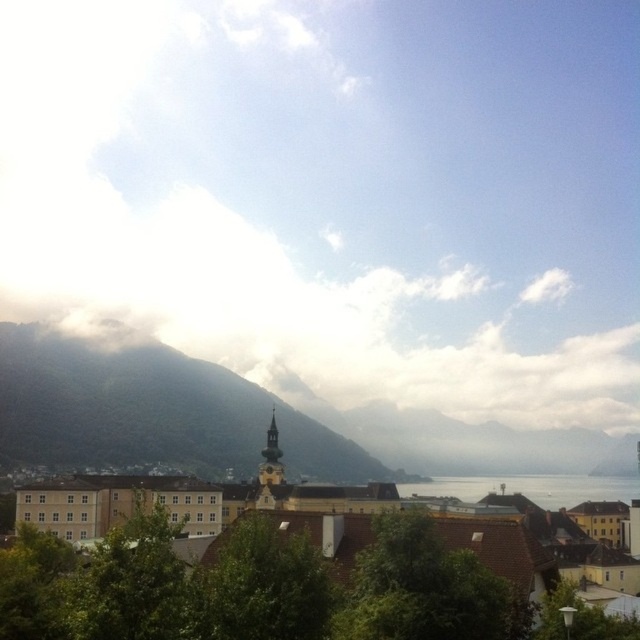
You are an architect designing a new observation deck that needs to be 2 meters tall. Based on the scene, will the white fluffy cloud at upper center or the transparent water at center be visible above the deck?

The white fluffy cloud at upper center has a greater height compared to the transparent water at center, so the cloud will be visible above the deck while the water will be below it.

You are standing at the camera position and want to visit the yellow matte building at center. If your walking speed is 3 miles per hour, approximately how many minutes will it take to reach the building?

The distance between you and the yellow matte building at center is 111.52 feet. Converting this to miles, it is approximately 0.021 miles. At a walking speed of 3 mph, the time taken would be roughly 0.021 miles divided by 3 mph, which equals 0.007 hours. Converting hours to minutes gives about 0.42 minutes, so approximately 0.4 minutes or 25 seconds.